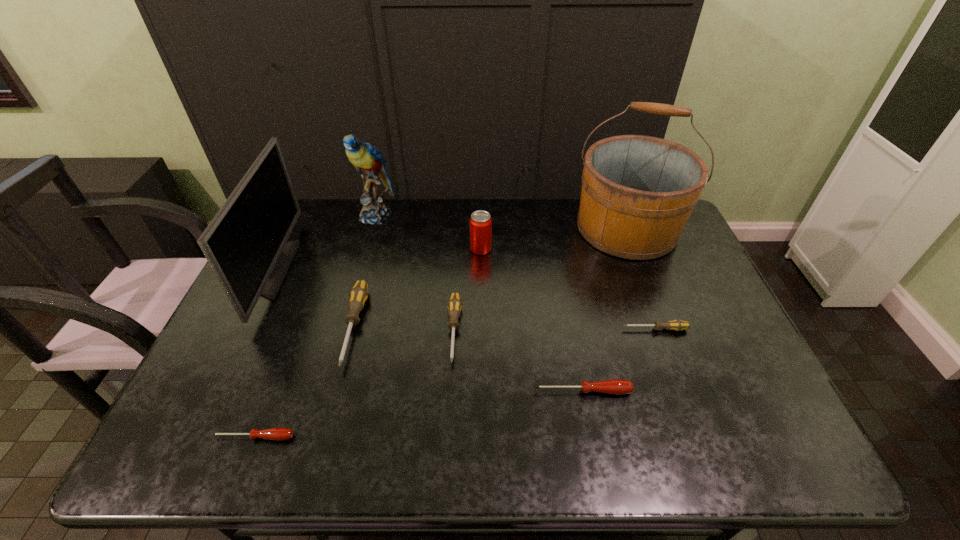
The image size is (960, 540). Find the location of `vacant point located 0.090m at the tip of the tallest screwdriver`. vacant point located 0.090m at the tip of the tallest screwdriver is located at coordinates (333, 405).

Identify the location of vacant space located at the tip of the third screwdriver from right to left. (448, 440).

Where is `free space located 0.090m on the left of the farther red screwdriver`? The width and height of the screenshot is (960, 540). free space located 0.090m on the left of the farther red screwdriver is located at coordinates (495, 391).

Find the location of `free spot located 0.340m at the tip of the rightmost screwdriver`. free spot located 0.340m at the tip of the rightmost screwdriver is located at coordinates (497, 329).

You are a GUI agent. You are given a task and a screenshot of the screen. Output one action in this format:
    pyautogui.click(x=<x>, y=<y>)
    Task: Click on the vacant area situated at the tip of the rightmost screwdriver
    The width and height of the screenshot is (960, 540).
    Given the screenshot: What is the action you would take?
    pyautogui.click(x=564, y=329)

What are the coordinates of `vacant space located 0.210m at the tip of the rightmost screwdriver` in the screenshot? It's located at (545, 329).

Identify the location of free space located on the back of the nearest object. The image size is (960, 540). (291, 342).

Where is `bucket that is at the far edge`? bucket that is at the far edge is located at coordinates coord(638,192).

I want to click on parrot situated at the far edge, so 368,160.

Locate an element on the screen. Image resolution: width=960 pixels, height=540 pixels. monitor situated at the far edge is located at coordinates (245, 244).